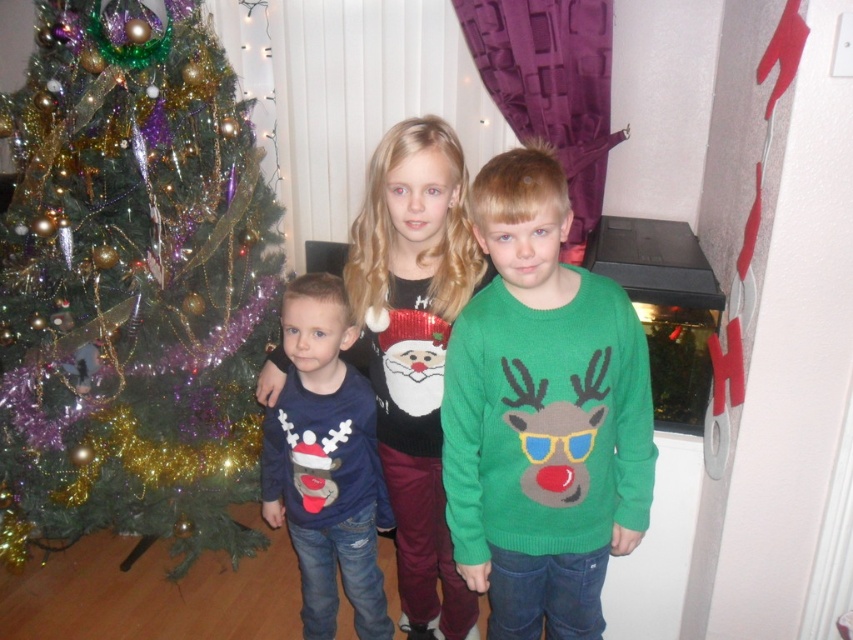
Question: Is the position of shiny sequin sweater at center less distant than that of matte blue sweater at center?

Choices:
 (A) no
 (B) yes

Answer: (B)

Question: Can you confirm if green knitted sweater at center is positioned above shiny sequin sweater at center?

Choices:
 (A) no
 (B) yes

Answer: (B)

Question: Which point is closer to the camera taking this photo?

Choices:
 (A) (215, 433)
 (B) (398, 593)
 (C) (479, 499)

Answer: (C)

Question: Does shiny green christmas tree at left have a lesser width compared to shiny sequin sweater at center?

Choices:
 (A) no
 (B) yes

Answer: (A)

Question: Which object appears closest to the camera in this image?

Choices:
 (A) shiny sequin sweater at center
 (B) shiny green christmas tree at left
 (C) matte blue sweater at center
 (D) green knitted sweater at center

Answer: (D)

Question: Which object is positioned farthest from the green knitted sweater at center?

Choices:
 (A) shiny green christmas tree at left
 (B) matte blue sweater at center

Answer: (A)